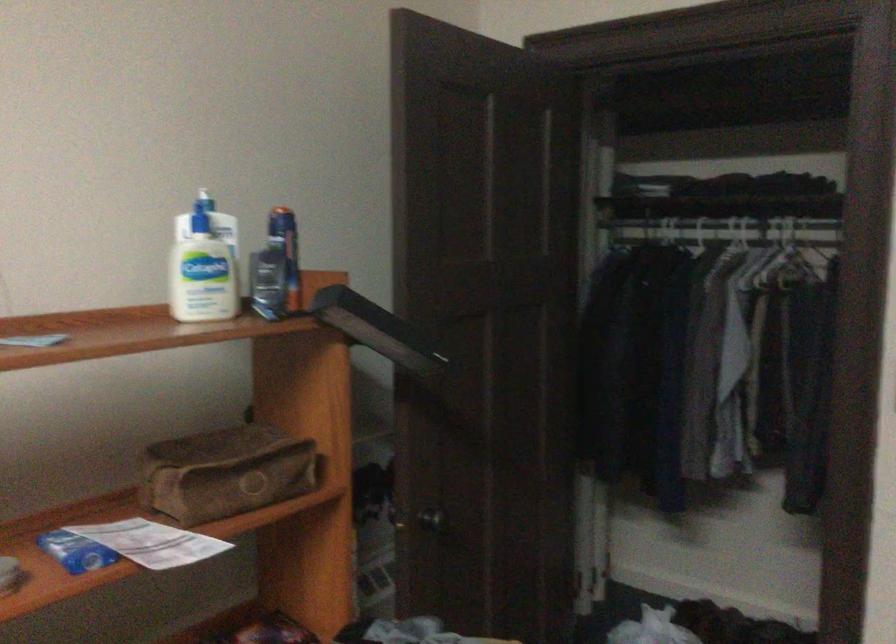
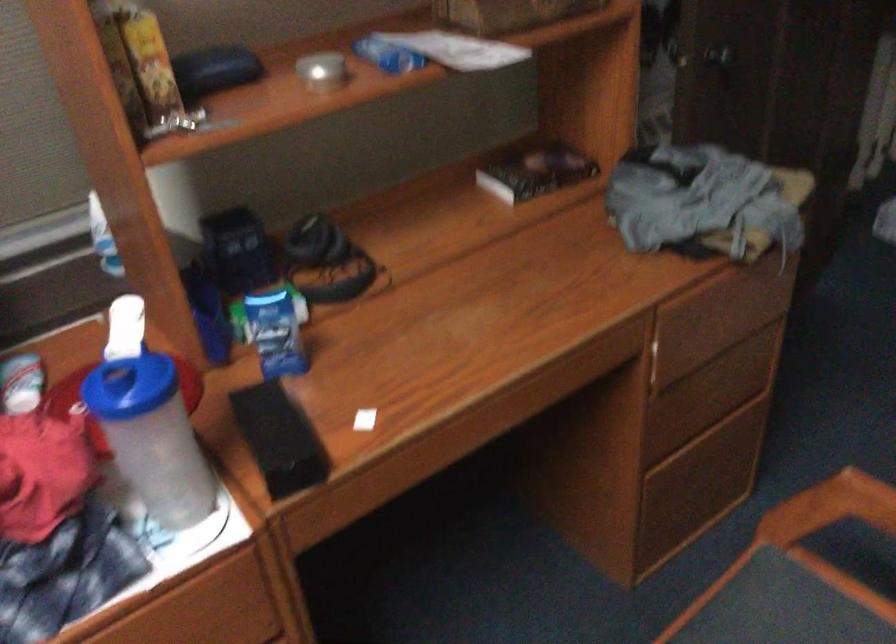
The point at (428, 522) is marked in the first image. Where is the corresponding point in the second image?

(718, 55)